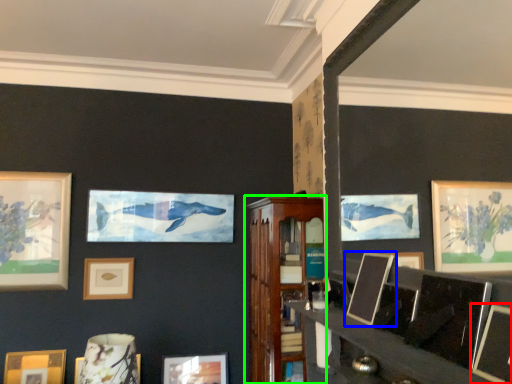
Question: Considering the real-world distances, which object is closest to picture frame (highlighted by a red box)? picture frame (highlighted by a blue box) or shelf (highlighted by a green box).

Choices:
 (A) picture frame
 (B) shelf

Answer: (A)